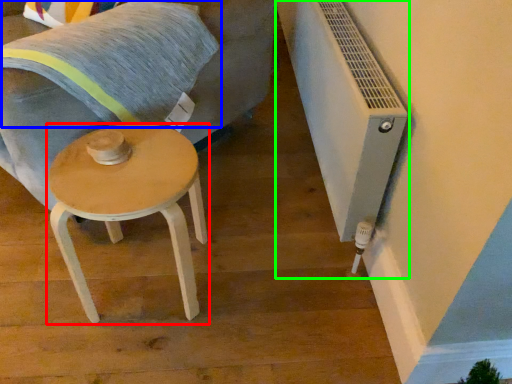
Question: Considering the real-world distances, which object is farthest from stool (highlighted by a red box)? pillow (highlighted by a blue box) or air conditioning (highlighted by a green box)?

Choices:
 (A) pillow
 (B) air conditioning

Answer: (B)